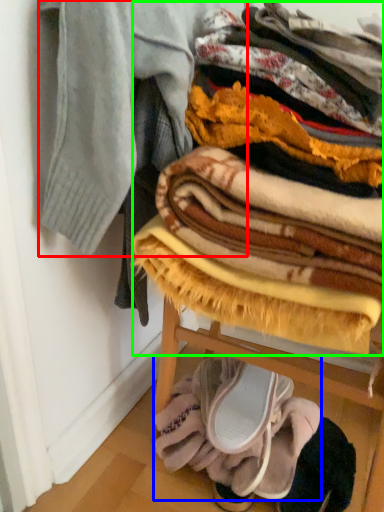
Question: Which is nearer to the garment (highlighted by a red box)? blanket (highlighted by a blue box) or blanket (highlighted by a green box).

Choices:
 (A) blanket
 (B) blanket

Answer: (B)